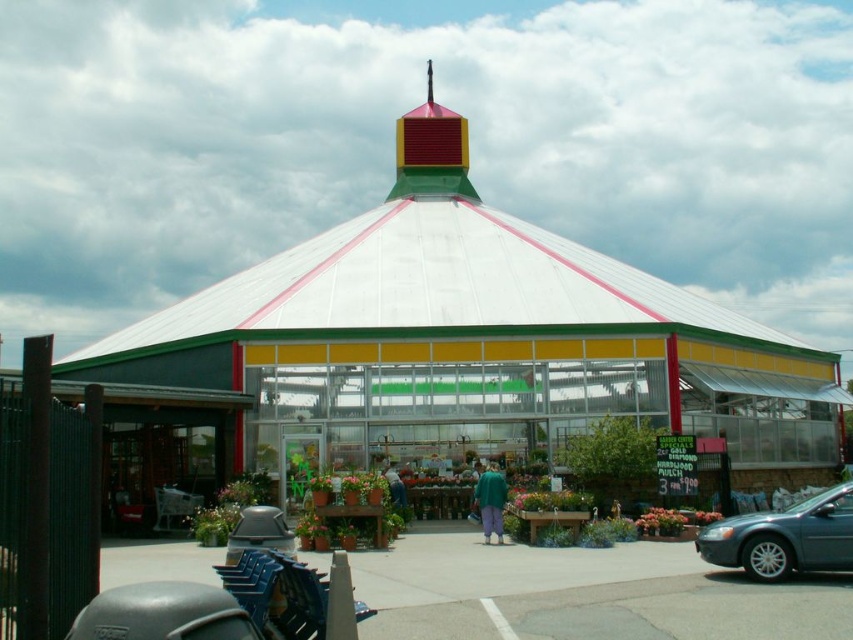
Based on the scene description provided, what does the point at coordinates (468, 339) represent?

The point at coordinates (468, 339) represents the transparent glass greenhouse at center as described in the scene.

You are a gardener who wants to water the plants in the transparent glass greenhouse at center and the green matte pants at center. Which one should you water first if you want to start from the lower part of the structure?

The green matte pants at center should be watered first because it is located below the transparent glass greenhouse at center.